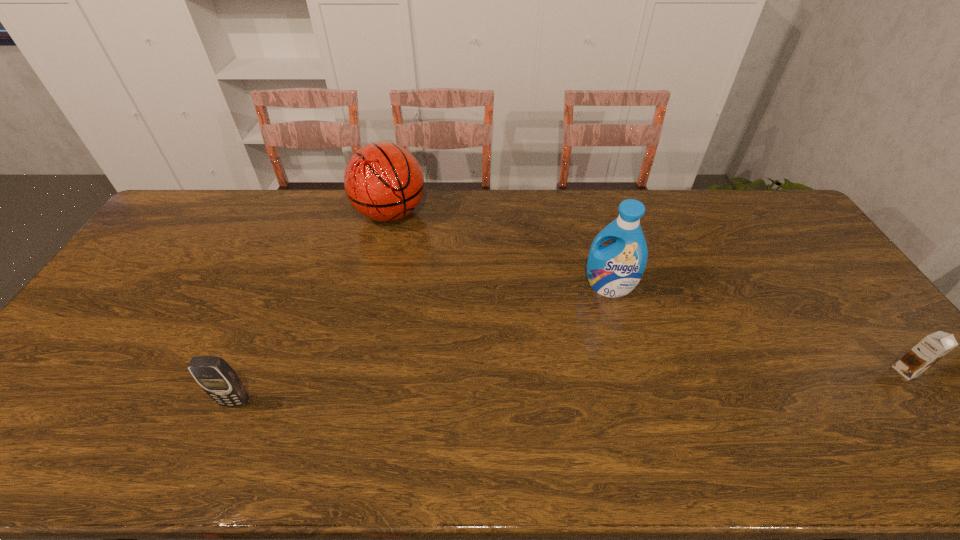
Where is `vacant region located 0.070m on the side with spill of the farthest object`? Image resolution: width=960 pixels, height=540 pixels. vacant region located 0.070m on the side with spill of the farthest object is located at coordinates (412, 247).

Where is `vacant area located 0.190m on the side with spill of the farthest object`? The width and height of the screenshot is (960, 540). vacant area located 0.190m on the side with spill of the farthest object is located at coordinates click(x=426, y=270).

Image resolution: width=960 pixels, height=540 pixels. Identify the location of vacant space located 0.240m on the front-facing side of the second object from right to left. (576, 360).

You are a GUI agent. You are given a task and a screenshot of the screen. Output one action in this format:
    pyautogui.click(x=<x>, y=<y>)
    Task: Click on the vacant space located on the front-facing side of the second object from right to left
    
    Given the screenshot: What is the action you would take?
    pyautogui.click(x=594, y=315)

The height and width of the screenshot is (540, 960). I want to click on vacant area situated on the front-facing side of the second object from right to left, so click(575, 363).

I want to click on object present at the far edge, so click(x=383, y=181).

Identify the location of object that is at the near edge. (217, 378).

The image size is (960, 540). What are the coordinates of `object that is at the right edge` in the screenshot? It's located at (933, 347).

This screenshot has height=540, width=960. Find the location of `free space at the far edge of the desktop`. free space at the far edge of the desktop is located at coordinates (451, 195).

The height and width of the screenshot is (540, 960). Find the location of `vacant region at the near edge`. vacant region at the near edge is located at coordinates (743, 392).